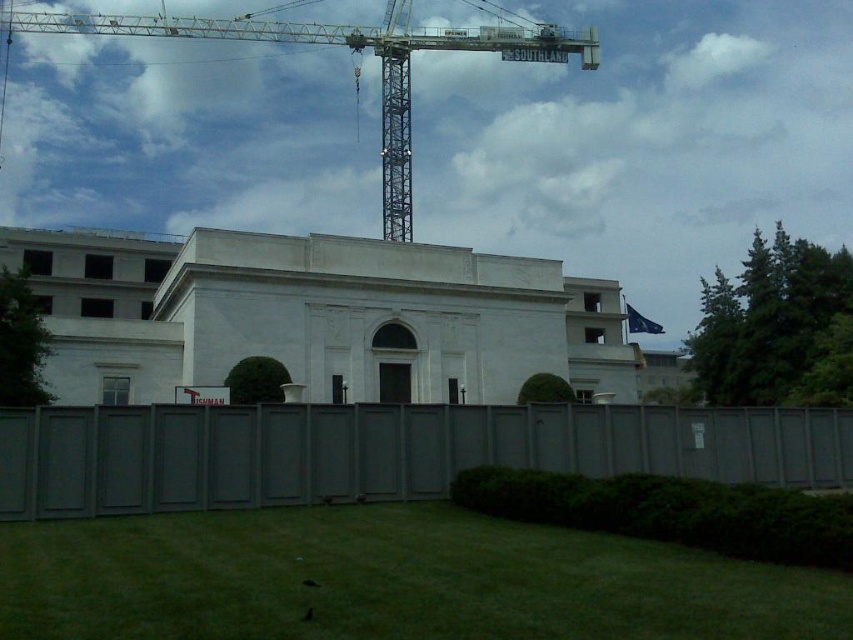
You are a construction worker who needs to move a 1.2 meter wide equipment through the gap between the gray wood fence at lower center and the metallic gray crane at upper center. Can the equipment pass through the gap?

The gray wood fence at lower center is thinner than the metallic gray crane at upper center, so the gap between them may be wide enough for the 1.2 meter wide equipment. However, without exact measurements, it is uncertain. Please check the actual space before moving the equipment.

You are a construction worker standing at the entrance of the building. You need to move a heavy beam from the ground to the roof. The beam is too long to fit through any doorway. How can you use the metallic gray crane at upper center to lift the beam over the gray wood fence at lower center?

The gray wood fence at lower center is positioned under the metallic gray crane at upper center, so you can operate the metallic gray crane at upper center to lift the beam vertically above the gray wood fence at lower center and move it to the roof.